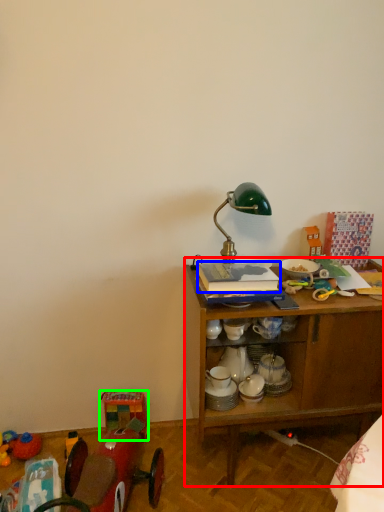
Question: Which object is the farthest from desk (highlighted by a red box)? Choose among these: book (highlighted by a blue box) or toy (highlighted by a green box).

Choices:
 (A) book
 (B) toy

Answer: (B)